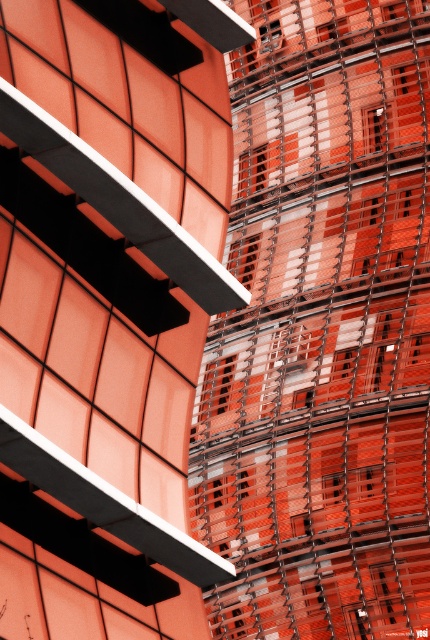
Consider the image. You are an architect analyzing the spatial relationship between the metallic grid tower at center and the metallic grid at center in the image. Which one is located to the left?

The metallic grid tower at center is positioned on the left side of metallic grid at center.

You are standing at the viewpoint of the image and see two points labeled as point (27,342) and point (423,356). Which point is closer to you?

Point (27,342) is closer to you because it is in front of point (423,356).

You are an architect analyzing the central area of the image. You notice two structures labeled as metallic grid tower at center and metallic grid at center. Which of these two structures is smaller in size?

The metallic grid tower at center has a smaller size compared to the metallic grid at center.